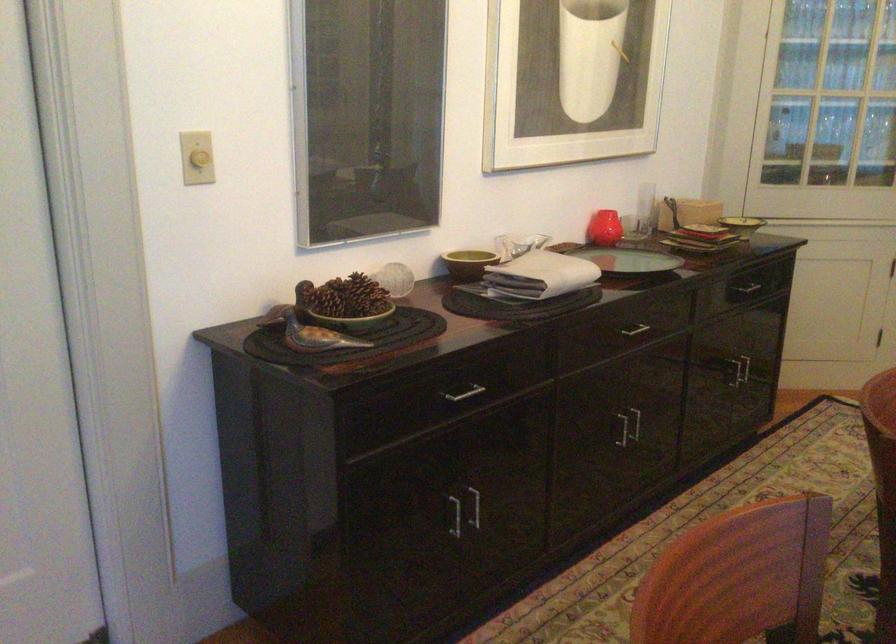
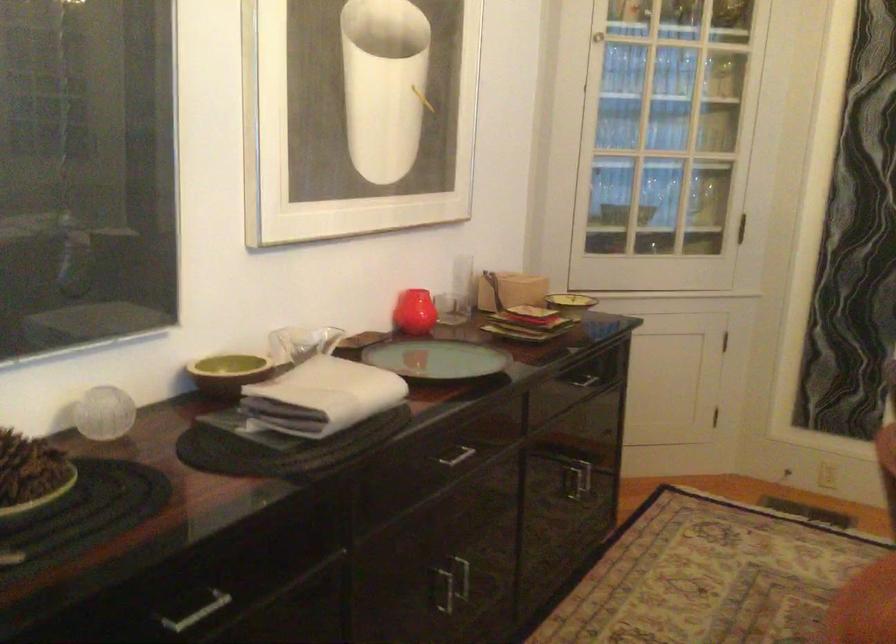
Where in the second image is the point corresponding to (x=625, y=433) from the first image?

(443, 589)